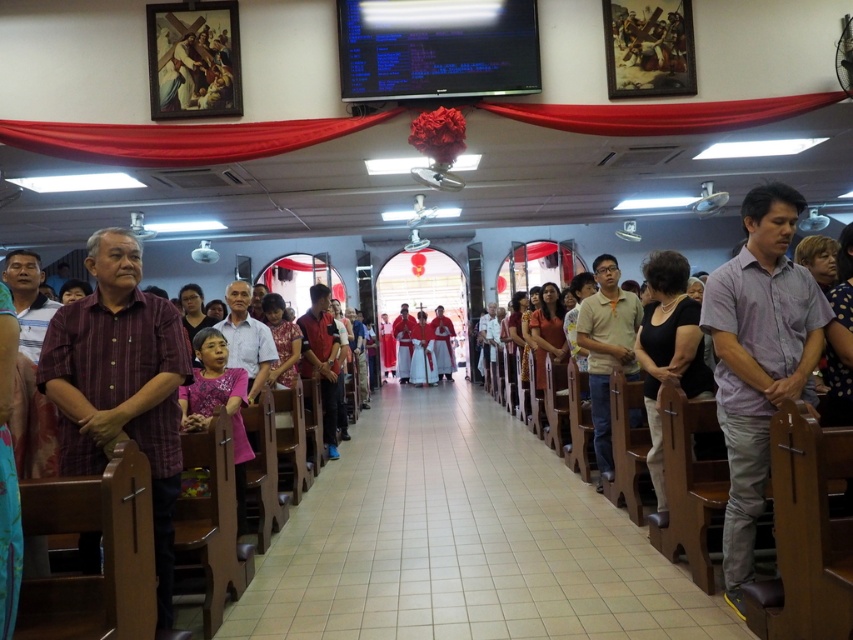
In the scene shown: You are standing at the entrance of the church and see a point marked at coordinates (668, 348). According to the scene description, where is this point located?

The point at coordinates (668, 348) is located on the black matte dress at center.

You are a photographer standing at the back of the church. You want to take a photo of both the light purple shirt at center and the purple cotton shirt at center. Can you fit both shirts into your camera frame if your camera has a minimum required distance of 1 inch between subjects to focus properly?

The light purple shirt at center and the purple cotton shirt at center are 0.96 inches apart, which is less than the camera requirement of 1 inch. Therefore, the camera may not focus properly on both shirts simultaneously.

You are standing at the back of the church and want to hand a note to the person wearing the light purple shirt at center and the purple cotton shirt at center. Which one should you approach first based on their positions?

You should approach the light purple shirt at center first because it is closer to the viewer than the purple cotton shirt at center.